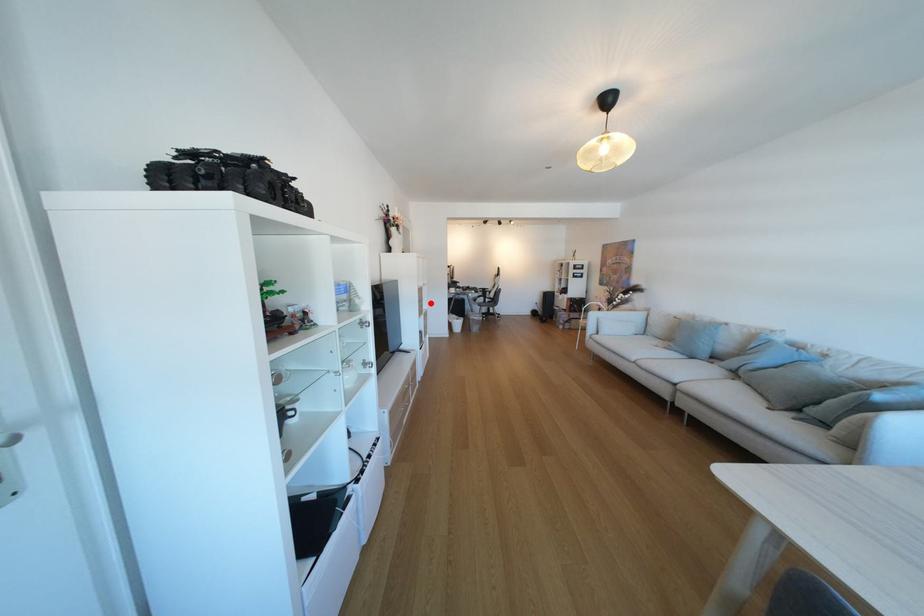
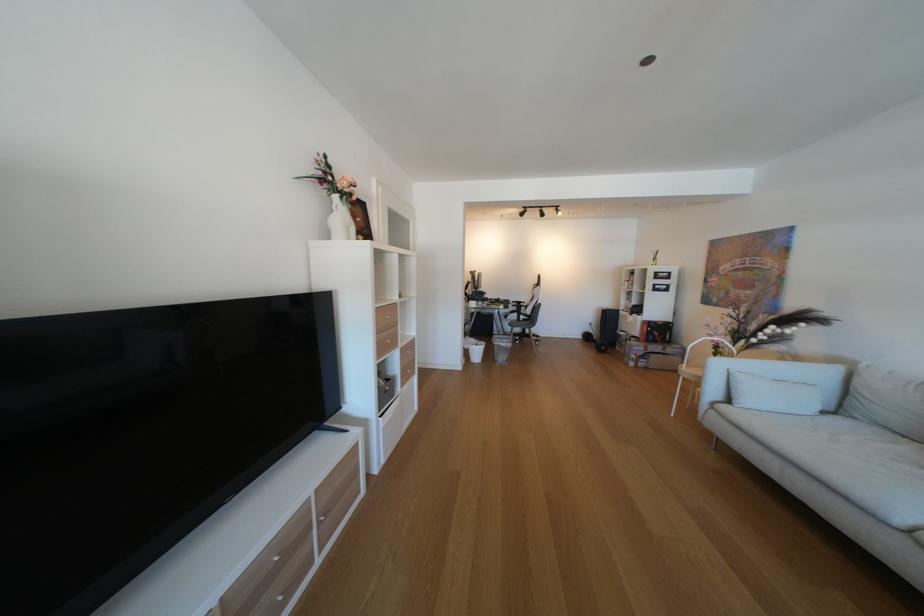
Question: I am providing you with two images of the same scene from different viewpoints. A red point is marked on the first image. Can you still see the location of the red point in image 2?

Choices:
 (A) Yes
 (B) No

Answer: (A)